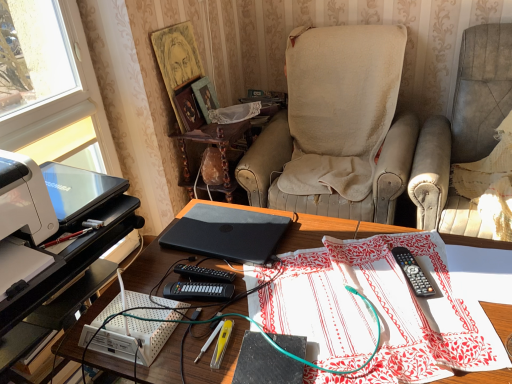
You are a GUI agent. You are given a task and a screenshot of the screen. Output one action in this format:
    pyautogui.click(x=<x>, y=<y>)
    Task: Click on the spots to the right of orange matte laptop at center, placed as the 2th laptop when sorted from left to right
    This screenshot has height=384, width=512.
    Given the screenshot: What is the action you would take?
    pyautogui.click(x=319, y=242)